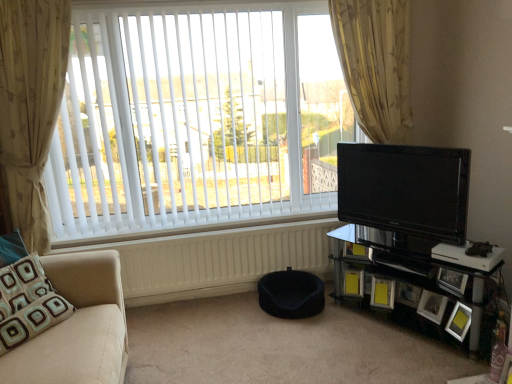
Image resolution: width=512 pixels, height=384 pixels. Identify the location of free point above black fabric pet bed at lower center (from a real-world perspective). (273, 337).